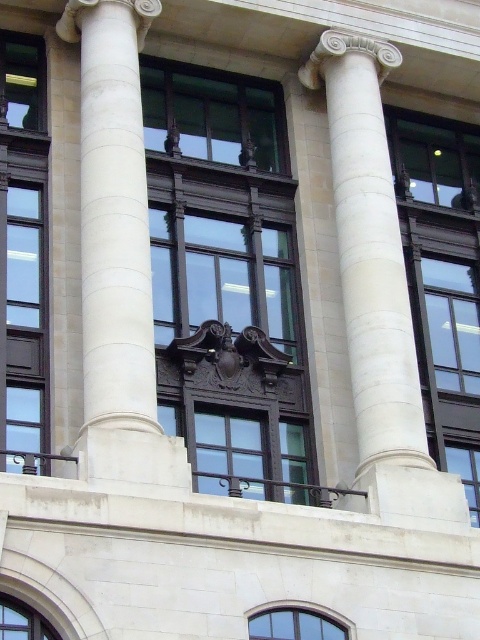
You are standing at the camera position and want to reach the point marked at coordinates (x=187, y=316) on the building facade. If your walking speed is 3 feet per second, how many seconds will it take you to reach that point?

The distance between the point at coordinates (x=187, y=316) and the camera is 177.90 feet. At a walking speed of 3 feet per second, it would take 177.90 divided by 3, which equals approximately 59.3 seconds to reach the point.

You are an architect designing a new building and want to ensure that the transparent glass window at upper right will be visible from the entrance. The entrance is located directly in front of the white marble column at center. What is the minimum distance you need to maintain between the entrance and the building facade to ensure the window is visible?

The minimum distance required is 18.21 meters. This ensures that the transparent glass window at upper right remains visible from the entrance positioned in front of the white marble column at center.

You are an architect designing a new building and want to replicate the window sizes from the image. Which of the two windows, the matte glass window at left or the clear glass window at upper right, should you make larger in your design?

The matte glass window at left is bigger than the clear glass window at upper right, so you should make the matte glass window at left larger in your design.